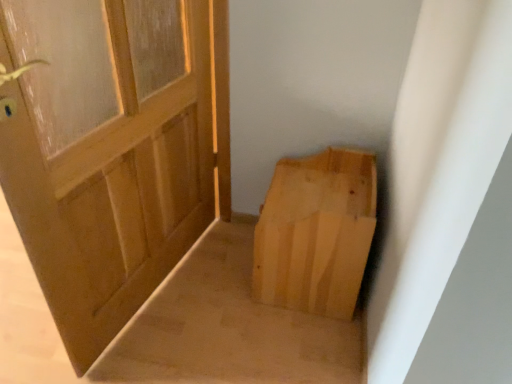
Question: Is natural wood cardboard box at lower right bigger or smaller than natural wood door at left?

Choices:
 (A) big
 (B) small

Answer: (B)

Question: In the image, is natural wood cardboard box at lower right on the left side or the right side of natural wood door at left?

Choices:
 (A) left
 (B) right

Answer: (B)

Question: From the image's perspective, relative to natural wood door at left, is natural wood cardboard box at lower right above or below?

Choices:
 (A) below
 (B) above

Answer: (A)

Question: Is point tap(79, 160) closer or farther from the camera than point tap(289, 261)?

Choices:
 (A) farther
 (B) closer

Answer: (B)

Question: Considering their positions, is natural wood door at left located in front of or behind natural wood cardboard box at lower right?

Choices:
 (A) behind
 (B) front

Answer: (B)

Question: Looking at their shapes, would you say natural wood door at left is wider or thinner than natural wood cardboard box at lower right?

Choices:
 (A) thin
 (B) wide

Answer: (A)

Question: Based on their sizes in the image, would you say natural wood door at left is bigger or smaller than natural wood cardboard box at lower right?

Choices:
 (A) big
 (B) small

Answer: (A)